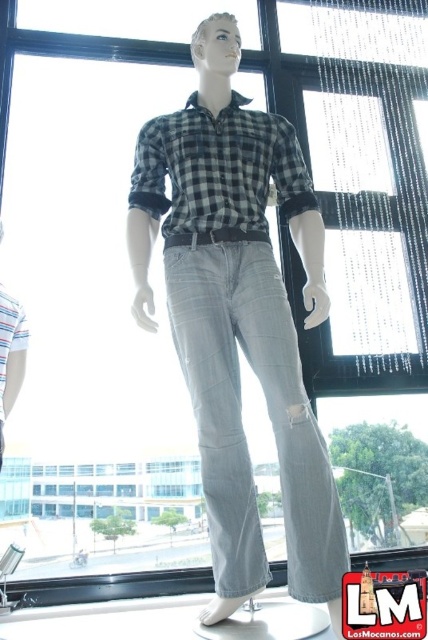
Does light blue denim jeans at center have a lesser height compared to checkered fabric shirt at center?

Incorrect, light blue denim jeans at center's height does not fall short of checkered fabric shirt at center's.

Does point (243, 333) lie behind point (177, 212)?

No, (243, 333) is closer to viewer.

Is point (172, 244) closer to camera compared to point (158, 216)?

Yes.

Where is `light blue denim jeans at center`? light blue denim jeans at center is located at coordinates (240, 413).